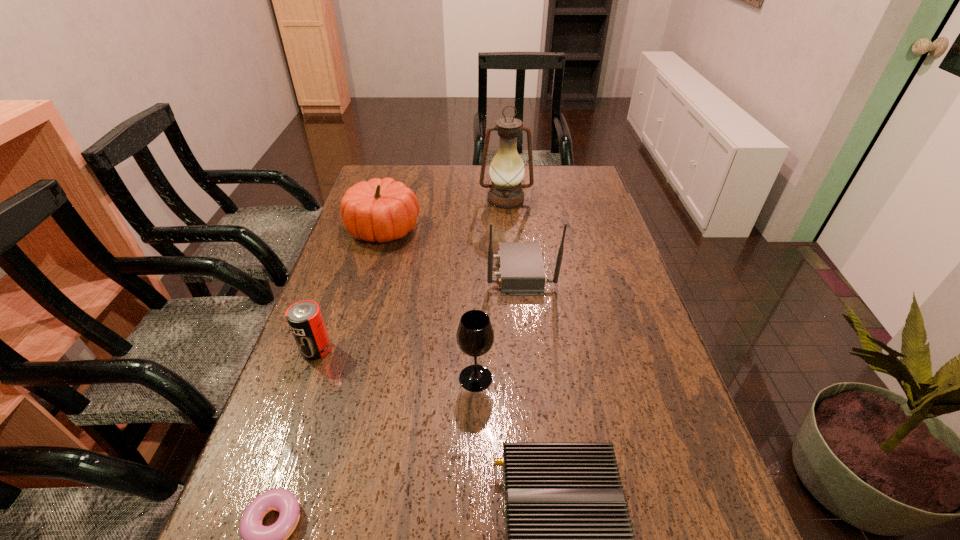
Find the location of a particular element. The width and height of the screenshot is (960, 540). the tallest object is located at coordinates (507, 169).

Where is `the second tallest object`? This screenshot has width=960, height=540. the second tallest object is located at coordinates (521, 273).

Where is `the farther router`? the farther router is located at coordinates (521, 273).

Where is `the fifth farthest object`? the fifth farthest object is located at coordinates (475, 336).

You are a GUI agent. You are given a task and a screenshot of the screen. Output one action in this format:
    pyautogui.click(x=<x>, y=<y>)
    Task: Click on the pumpkin
    
    Given the screenshot: What is the action you would take?
    pyautogui.click(x=383, y=210)

In order to click on the fifth tallest object in this screenshot , I will do `click(304, 317)`.

Find the location of a particular element. This screenshot has width=960, height=540. can is located at coordinates point(304,317).

This screenshot has height=540, width=960. I want to click on free space located on the back of the oil lamp, so click(x=504, y=172).

You are a GUI agent. You are given a task and a screenshot of the screen. Output one action in this format:
    pyautogui.click(x=<x>, y=<y>)
    Task: Click on the free space located on the back of the taller router to connect cables
    This screenshot has height=540, width=960.
    Given the screenshot: What is the action you would take?
    pyautogui.click(x=451, y=272)

Identify the location of vacant space located on the back of the taller router to connect cables. (345, 272).